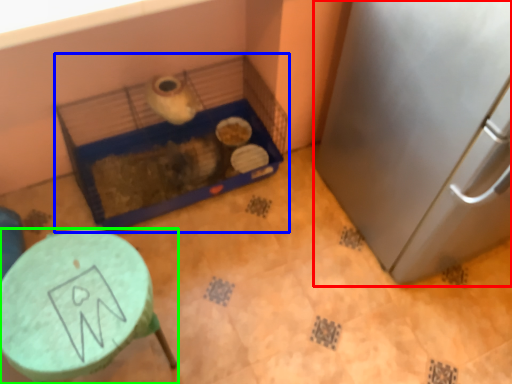
Question: Considering the real-world distances, which object is closest to appliance (highlighted by a red box)? bird cage (highlighted by a blue box) or furniture (highlighted by a green box).

Choices:
 (A) bird cage
 (B) furniture

Answer: (A)